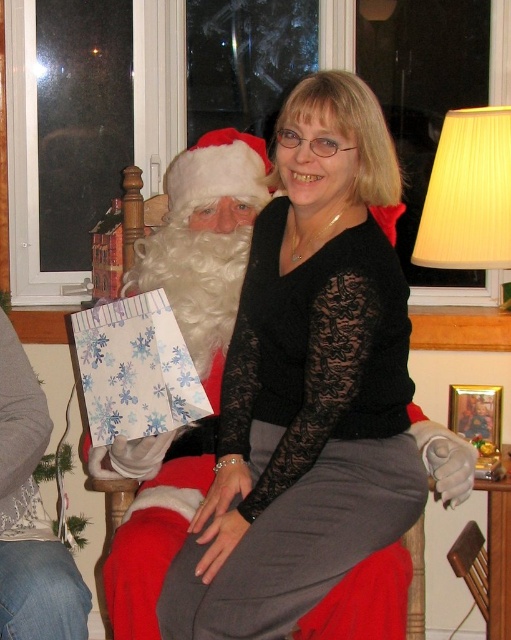
From the picture: You are a photographer setting up for a holiday photo shoot. You need to ensure that the black lace sweater at center and the white fluffy beard at left are both visible in the frame. Based on their positions, which object is closer to the camera?

The black lace sweater at center is closer to the camera because it is in front of the white fluffy beard at left.

You are a photographer taking a picture of the scene. You notice the black lace sweater at center and the white fluffy beard at left. Which object is positioned higher in the frame?

The black lace sweater at center is positioned higher in the frame than the white fluffy beard at left.